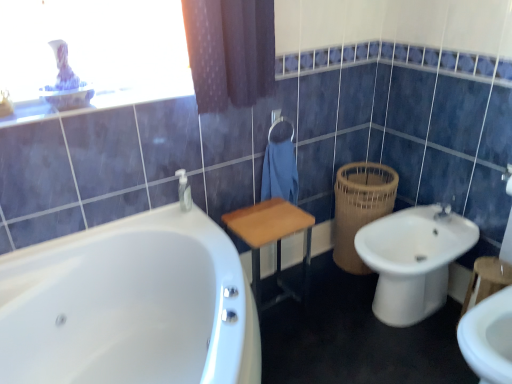
Locate an element on the screen. translucent plastic soap dispenser at center is located at coordinates (184, 190).

Consider the image. Measure the distance between point (182, 205) and camera.

Point (182, 205) is 5.82 feet from camera.

At what (x,y) coordinates should I click in order to perform the action: click on white glossy bathtub at lower left. Please return your answer as a coordinate pair (x, y). The width and height of the screenshot is (512, 384). Looking at the image, I should click on (130, 306).

In order to face wooden table at center, should I rotate leftwards or rightwards?

Rotate right and turn 1.807 degrees.

Where is `woven brown basket at right`? woven brown basket at right is located at coordinates (360, 207).

Considering the positions of objects woven brown basket at right and blue fabric towel at center in the image provided, who is behind, woven brown basket at right or blue fabric towel at center?

woven brown basket at right is further away from the camera.

Could you tell me if woven brown basket at right is facing blue fabric towel at center?

Yes, woven brown basket at right is aimed at blue fabric towel at center.

How far apart are translucent plastic soap dispenser at center and wooden table at center?

translucent plastic soap dispenser at center is 12.20 inches away from wooden table at center.

Does point (186, 204) come behind point (282, 235)?

Yes, point (186, 204) is behind point (282, 235).

From the image's perspective, which one is positioned lower, translucent plastic soap dispenser at center or wooden table at center?

wooden table at center.

Is translucent plastic soap dispenser at center closer to the viewer compared to wooden table at center?

No, the depth of translucent plastic soap dispenser at center is greater than that of wooden table at center.

Does woven brown basket at right have a larger size compared to translucent plastic soap dispenser at center?

Correct, woven brown basket at right is larger in size than translucent plastic soap dispenser at center.

Measure the distance from woven brown basket at right to translucent plastic soap dispenser at center.

They are 34.91 inches apart.

From their relative heights in the image, would you say woven brown basket at right is taller or shorter than translucent plastic soap dispenser at center?

woven brown basket at right is taller than translucent plastic soap dispenser at center.

Which is more to the left, woven brown basket at right or translucent plastic soap dispenser at center?

From the viewer's perspective, translucent plastic soap dispenser at center appears more on the left side.

Is translucent plastic soap dispenser at center at the left side of white glossy bathtub at lower left?

No, translucent plastic soap dispenser at center is not to the left of white glossy bathtub at lower left.

From the image's perspective, which is above, translucent plastic soap dispenser at center or white glossy bathtub at lower left?

translucent plastic soap dispenser at center.

From a real-world perspective, which is physically below, translucent plastic soap dispenser at center or white glossy bathtub at lower left?

In real-world perspective, white glossy bathtub at lower left is lower.

Is translucent plastic soap dispenser at center taller than white glossy bathtub at lower left?

In fact, translucent plastic soap dispenser at center may be shorter than white glossy bathtub at lower left.

Is woven brown basket at right looking in the opposite direction of white ceramic bidet at lower right?

No, woven brown basket at right's orientation is not away from white ceramic bidet at lower right.

Is point (392, 170) more distant than point (431, 220)?

Yes, it is behind point (431, 220).

This screenshot has width=512, height=384. Identify the location of toilet on the right of woven brown basket at right. (413, 260).

In the image, is woven brown basket at right on the left side or the right side of white ceramic bidet at lower right?

Clearly, woven brown basket at right is on the left of white ceramic bidet at lower right in the image.

Where is `bath towel that appears above the woven brown basket at right (from a real-world perspective)`? This screenshot has width=512, height=384. bath towel that appears above the woven brown basket at right (from a real-world perspective) is located at coordinates (280, 172).

From a real-world perspective, who is located higher, blue fabric towel at center or woven brown basket at right?

In real-world perspective, blue fabric towel at center is above.

Could you tell me if blue fabric towel at center is facing woven brown basket at right?

No, blue fabric towel at center is not turned towards woven brown basket at right.

Which of these two, blue fabric towel at center or woven brown basket at right, is thinner?

blue fabric towel at center.

Which is more to the right, white ceramic bidet at lower right or white glossy bathtub at lower left?

white ceramic bidet at lower right is more to the right.

Can you tell me how much white ceramic bidet at lower right and white glossy bathtub at lower left differ in facing direction?

→ The facing directions of white ceramic bidet at lower right and white glossy bathtub at lower left are 89.6 degrees apart.

Is white ceramic bidet at lower right wider than white glossy bathtub at lower left?

In fact, white ceramic bidet at lower right might be narrower than white glossy bathtub at lower left.

Between white ceramic bidet at lower right and white glossy bathtub at lower left, which one has smaller size?

With smaller size is white ceramic bidet at lower right.

There is a woven brown basket at right. Where is `bath towel above it (from a real-world perspective)`? This screenshot has width=512, height=384. bath towel above it (from a real-world perspective) is located at coordinates pyautogui.click(x=280, y=172).

Locate an element on the screen. The height and width of the screenshot is (384, 512). vanity located below the translucent plastic soap dispenser at center (from the image's perspective) is located at coordinates (272, 240).

Which object lies nearer to the anchor point woven brown basket at right, white ceramic bidet at lower right or translucent plastic soap dispenser at center?

A: white ceramic bidet at lower right is closer to woven brown basket at right.

Based on their spatial positions, is blue fabric towel at center or woven brown basket at right further from wooden table at center?

woven brown basket at right is positioned further to the anchor wooden table at center.

Estimate the real-world distances between objects in this image. Which object is further from translucent plastic soap dispenser at center, wooden table at center or white glossy bathtub at lower left?

white glossy bathtub at lower left lies further to translucent plastic soap dispenser at center than the other object.

Considering their positions, is white glossy bathtub at lower left positioned closer to woven brown basket at right than translucent plastic soap dispenser at center?

translucent plastic soap dispenser at center is positioned closer to the anchor woven brown basket at right.

When comparing their distances from white ceramic bidet at lower right, does blue fabric towel at center or woven brown basket at right seem further?

The object further to white ceramic bidet at lower right is blue fabric towel at center.

From the image, which object appears to be farther from white glossy bathtub at lower left, woven brown basket at right or white ceramic bidet at lower right?

woven brown basket at right is positioned further to the anchor white glossy bathtub at lower left.

In the scene shown: When comparing their distances from wooden table at center, does translucent plastic soap dispenser at center or blue fabric towel at center seem closer?

The object closer to wooden table at center is blue fabric towel at center.

Based on their spatial positions, is white ceramic bidet at lower right or wooden table at center further from woven brown basket at right?

wooden table at center is further to woven brown basket at right.

Identify the location of vanity between white glossy bathtub at lower left and blue fabric towel at center from front to back. (272, 240).

I want to click on vanity between translucent plastic soap dispenser at center and white ceramic bidet at lower right from left to right, so click(x=272, y=240).

Image resolution: width=512 pixels, height=384 pixels. In order to click on toiletry between white glossy bathtub at lower left and woven brown basket at right along the z-axis in this screenshot , I will do `click(184, 190)`.

The height and width of the screenshot is (384, 512). In order to click on toilet located between white glossy bathtub at lower left and translucent plastic soap dispenser at center in the depth direction in this screenshot , I will do `click(413, 260)`.